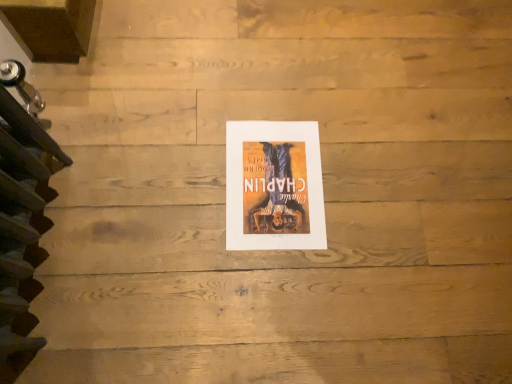
Question: Considering the positions of point (264, 220) and point (22, 359), is point (264, 220) closer or farther from the camera than point (22, 359)?

Choices:
 (A) farther
 (B) closer

Answer: (A)

Question: Is matte paper poster at center to the left or to the right of dark brown wooden stairs at left in the image?

Choices:
 (A) left
 (B) right

Answer: (B)

Question: Is matte paper poster at center taller or shorter than dark brown wooden stairs at left?

Choices:
 (A) short
 (B) tall

Answer: (A)

Question: Considering the positions of point (10, 170) and point (322, 200), is point (10, 170) closer or farther from the camera than point (322, 200)?

Choices:
 (A) closer
 (B) farther

Answer: (A)

Question: In terms of width, does dark brown wooden stairs at left look wider or thinner when compared to matte paper poster at center?

Choices:
 (A) wide
 (B) thin

Answer: (B)

Question: Is dark brown wooden stairs at left taller or shorter than matte paper poster at center?

Choices:
 (A) tall
 (B) short

Answer: (A)

Question: Is dark brown wooden stairs at left to the left or to the right of matte paper poster at center in the image?

Choices:
 (A) left
 (B) right

Answer: (A)